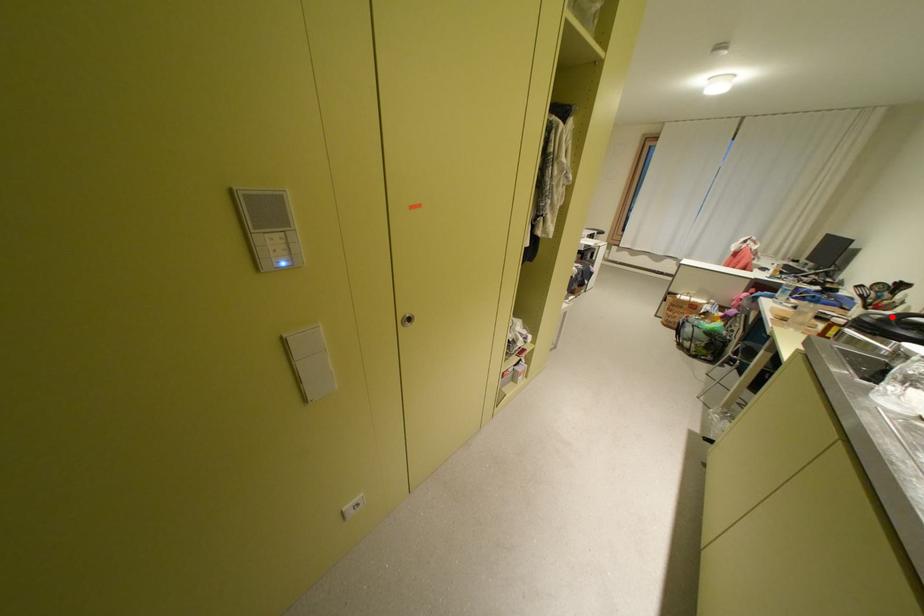
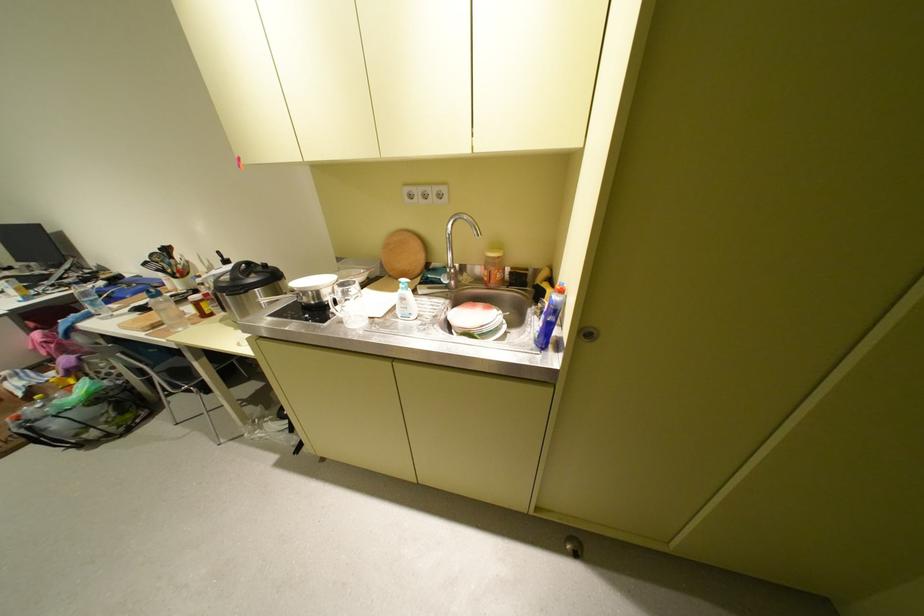
Question: I am providing you with two images of the same scene from different viewpoints. A red point is marked on the first image. At the location where the point appears in image 1, is it still visible in image 2?

Choices:
 (A) Yes
 (B) No

Answer: (A)